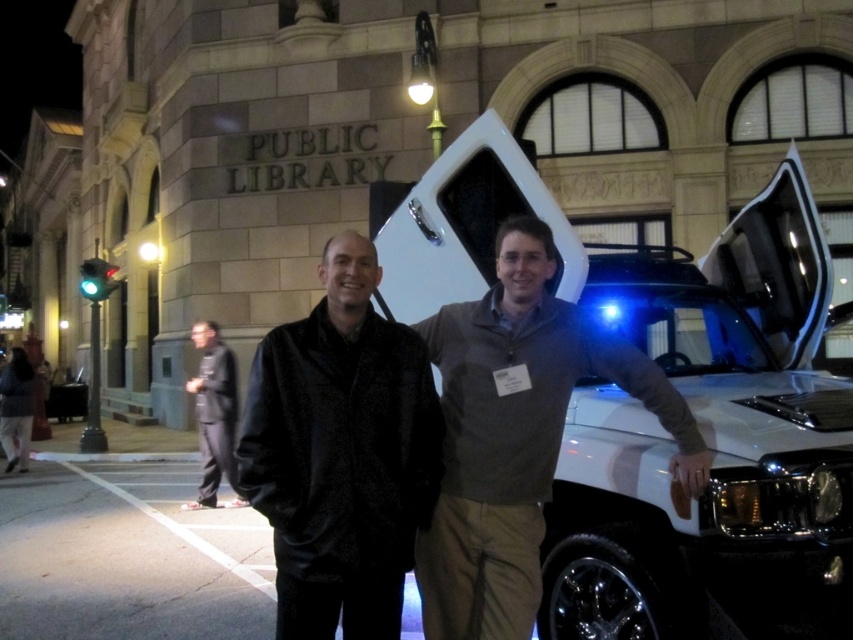
Which of these two, matte black jacket at center or black textured jacket at center, stands shorter?

black textured jacket at center

Can you confirm if matte black jacket at center is smaller than black textured jacket at center?

No.

Which is behind, point (463, 444) or point (349, 442)?

The point (463, 444) is more distant.

The image size is (853, 640). Identify the location of matte black jacket at center. (517, 435).

Is white glossy suv at right positioned at the back of matte black jacket at center?

Yes, it is.

Locate an element on the screen. white glossy suv at right is located at coordinates (653, 416).

Does matte black jacket at center have a greater width compared to dark gray suit at left?

Yes, matte black jacket at center is wider than dark gray suit at left.

Which is above, matte black jacket at center or dark gray suit at left?

matte black jacket at center

Measure the distance between matte black jacket at center and camera.

2.63 meters

You are a GUI agent. You are given a task and a screenshot of the screen. Output one action in this format:
    pyautogui.click(x=<x>, y=<y>)
    Task: Click on the matte black jacket at center
    This screenshot has width=853, height=640.
    Given the screenshot: What is the action you would take?
    tap(517, 435)